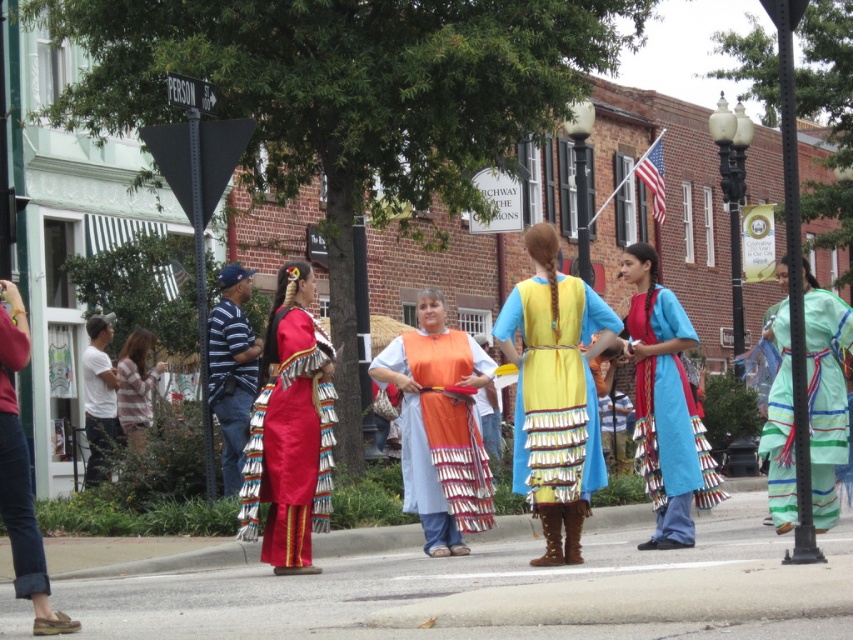
Question: Considering the real-world distances, which object is farthest from the shiny satin dress at center?

Choices:
 (A) striped fabric dress at lower left
 (B) white cotton shirt at left

Answer: (A)

Question: Can you confirm if denim pants at lower left is bigger than white cotton shirt at left?

Choices:
 (A) yes
 (B) no

Answer: (B)

Question: Does orange fabric skirt at center appear on the left side of striped fabric dress at lower left?

Choices:
 (A) yes
 (B) no

Answer: (B)

Question: Which point is closer to the camera taking this photo?

Choices:
 (A) (100, 426)
 (B) (32, 532)
 (C) (223, 368)
 (D) (144, 352)

Answer: (B)

Question: Based on their relative distances, which object is farther from the light green striped fabric dress at center?

Choices:
 (A) shiny satin dress at center
 (B) white cotton shirt at left
 (C) blue fabric dress at center

Answer: (B)

Question: Does shiny satin dress at center appear on the right side of white cotton shirt at left?

Choices:
 (A) no
 (B) yes

Answer: (B)